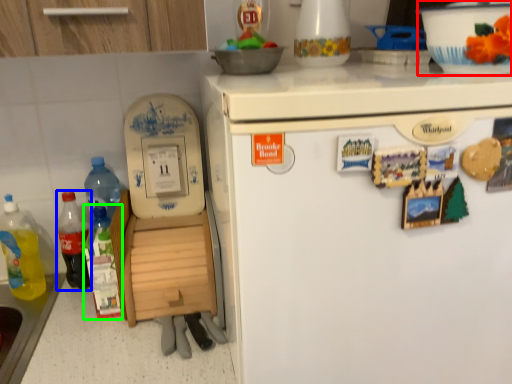
Question: Based on their relative distances, which object is nearer to bowl (highlighted by a red box)? Choose from bottle (highlighted by a blue box) and bottle (highlighted by a green box).

Choices:
 (A) bottle
 (B) bottle

Answer: (B)